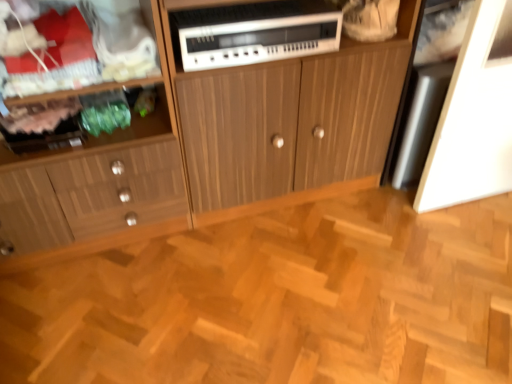
Question: Is natural wood parquet floor at center turned away from wooden cabinet at center, acting as the 1th cabinetry starting from the right?

Choices:
 (A) yes
 (B) no

Answer: (B)

Question: Would you consider natural wood parquet floor at center to be distant from wooden cabinet at center, acting as the 1th cabinetry starting from the right?

Choices:
 (A) no
 (B) yes

Answer: (A)

Question: Does natural wood parquet floor at center have a lesser height compared to wooden cabinet at center, acting as the 1th cabinetry starting from the right?

Choices:
 (A) no
 (B) yes

Answer: (B)

Question: Does natural wood parquet floor at center turn towards wooden cabinet at center, which appears as the second cabinetry when viewed from the left?

Choices:
 (A) no
 (B) yes

Answer: (A)

Question: Considering the relative sizes of natural wood parquet floor at center and wooden cabinet at center, which appears as the second cabinetry when viewed from the left, in the image provided, is natural wood parquet floor at center smaller than wooden cabinet at center, which appears as the second cabinetry when viewed from the left,?

Choices:
 (A) no
 (B) yes

Answer: (B)

Question: Looking at the image, does wooden cabinet at center, acting as the 1th cabinetry starting from the right, seem bigger or smaller compared to wooden cabinet at left, which appears as the first cabinetry when viewed from the left?

Choices:
 (A) small
 (B) big

Answer: (B)

Question: From the image's perspective, relative to wooden cabinet at left, placed as the second cabinetry when sorted from right to left, is wooden cabinet at center, acting as the 1th cabinetry starting from the right, above or below?

Choices:
 (A) above
 (B) below

Answer: (A)

Question: From a real-world perspective, relative to wooden cabinet at left, which appears as the first cabinetry when viewed from the left, is wooden cabinet at center, acting as the 1th cabinetry starting from the right, vertically above or below?

Choices:
 (A) below
 (B) above

Answer: (A)

Question: Relative to wooden cabinet at left, which appears as the first cabinetry when viewed from the left, is wooden cabinet at center, which appears as the second cabinetry when viewed from the left, in front or behind?

Choices:
 (A) front
 (B) behind

Answer: (B)

Question: From a real-world perspective, is wooden cabinet at left, placed as the second cabinetry when sorted from right to left, physically located above or below wooden cabinet at center, acting as the 1th cabinetry starting from the right?

Choices:
 (A) above
 (B) below

Answer: (A)

Question: Is wooden cabinet at left, placed as the second cabinetry when sorted from right to left, wider or thinner than wooden cabinet at center, acting as the 1th cabinetry starting from the right?

Choices:
 (A) thin
 (B) wide

Answer: (A)

Question: Is wooden cabinet at left, which appears as the first cabinetry when viewed from the left, spatially inside wooden cabinet at center, which appears as the second cabinetry when viewed from the left, or outside of it?

Choices:
 (A) outside
 (B) inside

Answer: (A)

Question: In the image, is wooden cabinet at left, placed as the second cabinetry when sorted from right to left, positioned in front of or behind wooden cabinet at center, acting as the 1th cabinetry starting from the right?

Choices:
 (A) behind
 (B) front

Answer: (B)

Question: From their relative heights in the image, would you say natural wood parquet floor at center is taller or shorter than white plastic stereo at center?

Choices:
 (A) tall
 (B) short

Answer: (B)

Question: Considering the positions of natural wood parquet floor at center and white plastic stereo at center in the image, is natural wood parquet floor at center bigger or smaller than white plastic stereo at center?

Choices:
 (A) big
 (B) small

Answer: (A)